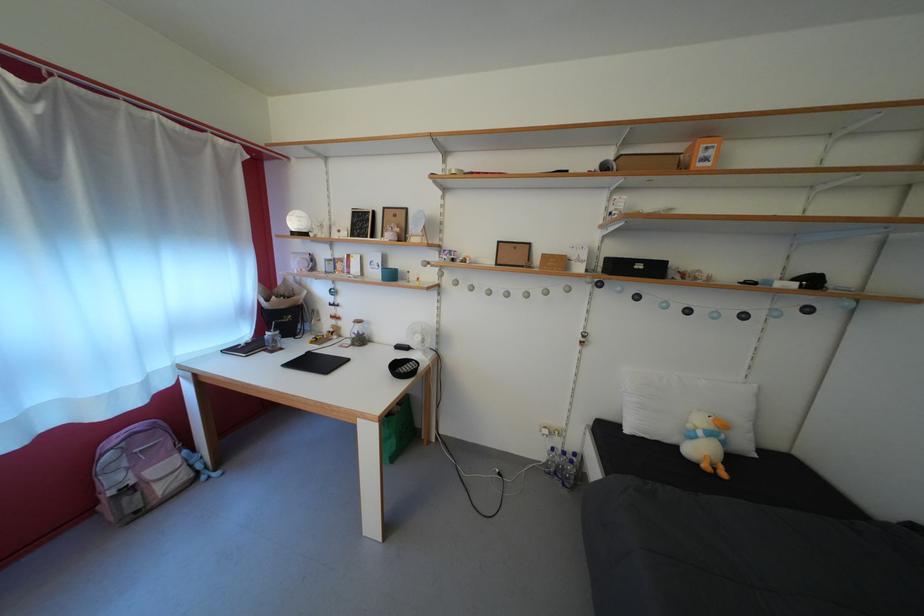
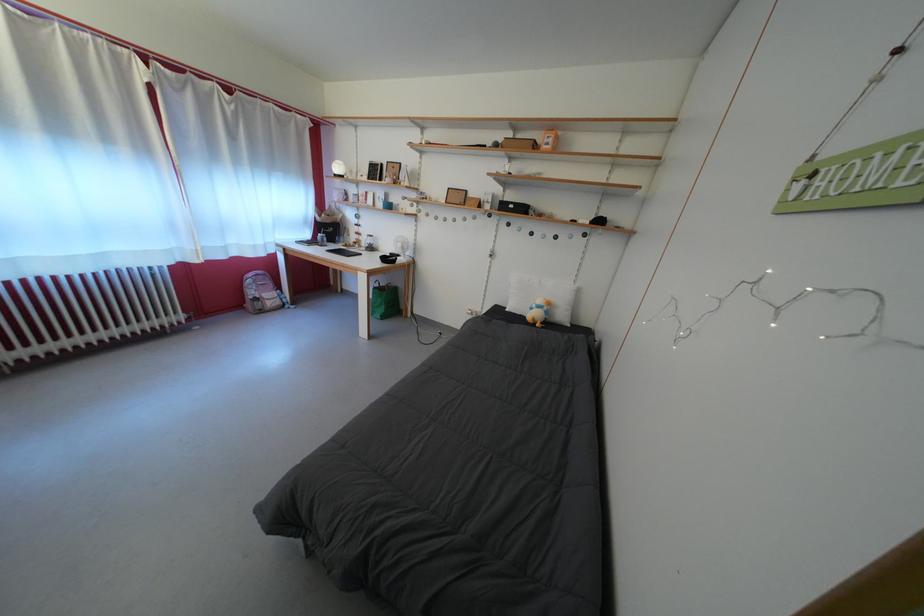
The point at (123,485) is marked in the first image. Where is the corresponding point in the second image?

(261, 299)